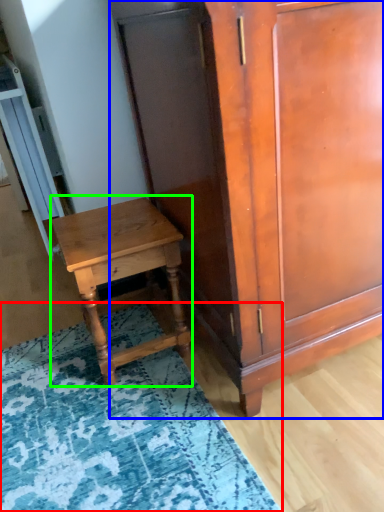
Question: Estimate the real-world distances between objects in this image. Which object is closer to mat (highlighted by a red box), cabinetry (highlighted by a blue box) or nightstand (highlighted by a green box)?

Choices:
 (A) cabinetry
 (B) nightstand

Answer: (B)